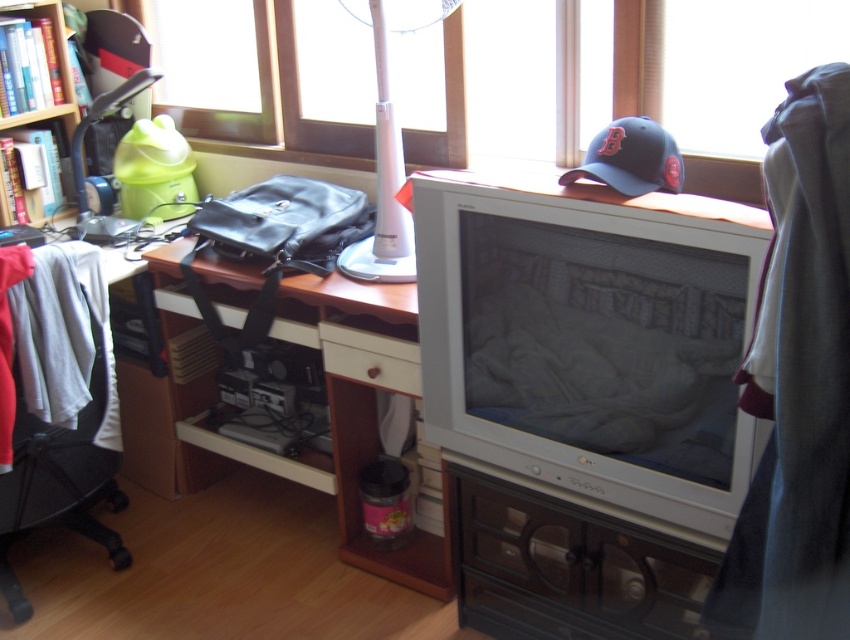
Which is in front, point (369, 317) or point (344, 352)?

Point (344, 352) is more forward.

Is the position of woodendesk at center less distant than that of white wood drawer at center?

That is True.

Who is more distant from viewer, (349, 436) or (333, 339)?

The point (349, 436) is more distant.

The image size is (850, 640). I want to click on woodendesk at center, so click(x=363, y=404).

Does point (525, 499) lie in front of point (26, 120)?

That is True.

Does point (656, 548) come behind point (66, 49)?

No, it is not.

Which is in front, point (463, 564) or point (66, 211)?

Point (463, 564)

Identify the location of metallic silver shelf at lower center. (568, 566).

Can you confirm if black fabric swivel chair at left is positioned above wooden bookcase at upper left?

Incorrect, black fabric swivel chair at left is not positioned above wooden bookcase at upper left.

Between black fabric swivel chair at left and wooden bookcase at upper left, which one appears on the right side from the viewer's perspective?

black fabric swivel chair at left

You are a GUI agent. You are given a task and a screenshot of the screen. Output one action in this format:
    pyautogui.click(x=<x>, y=<y>)
    Task: Click on the black fabric swivel chair at left
    This screenshot has width=850, height=640.
    Given the screenshot: What is the action you would take?
    pyautogui.click(x=60, y=404)